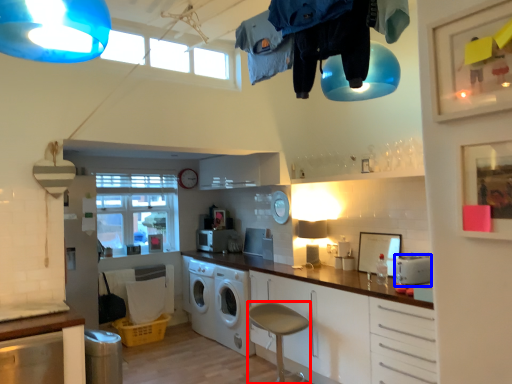
Question: Which point is further to the camera, bar stool (highlighted by a red box) or appliance (highlighted by a blue box)?

Choices:
 (A) bar stool
 (B) appliance

Answer: (B)